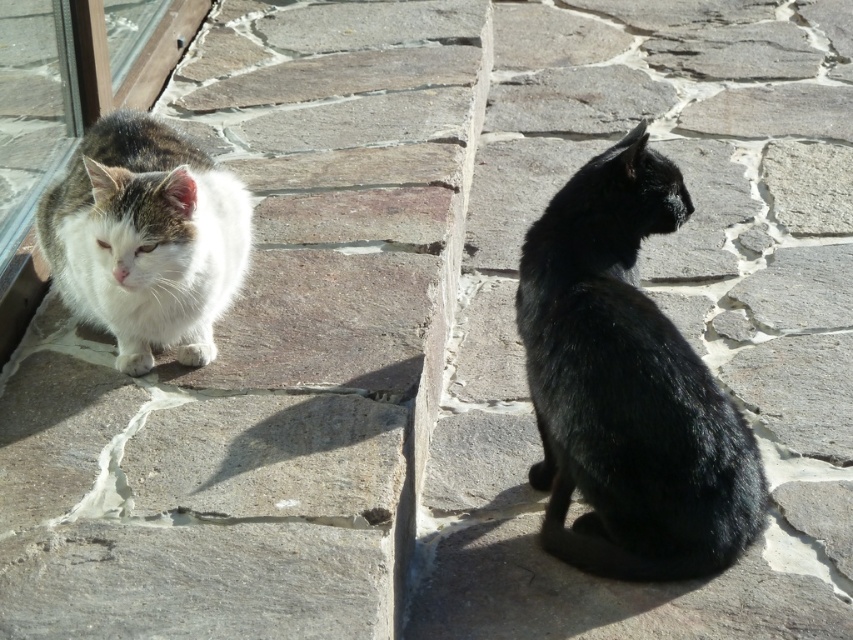
Can you confirm if shiny black cat at center is positioned to the right of white fluffy cat at left?

Yes, shiny black cat at center is to the right of white fluffy cat at left.

Which is in front, point (538, 250) or point (84, 172)?

Point (538, 250)

Identify the location of shiny black cat at center. (627, 387).